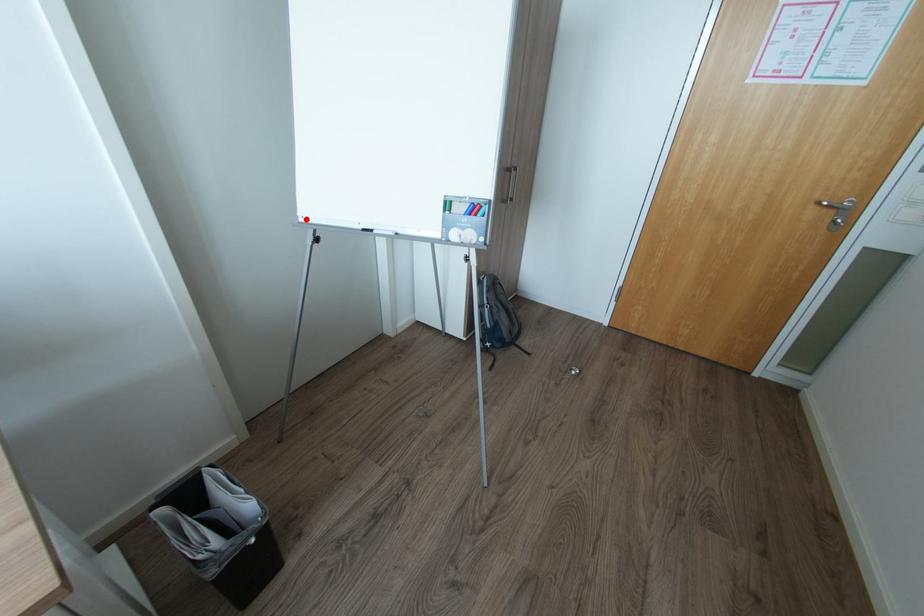
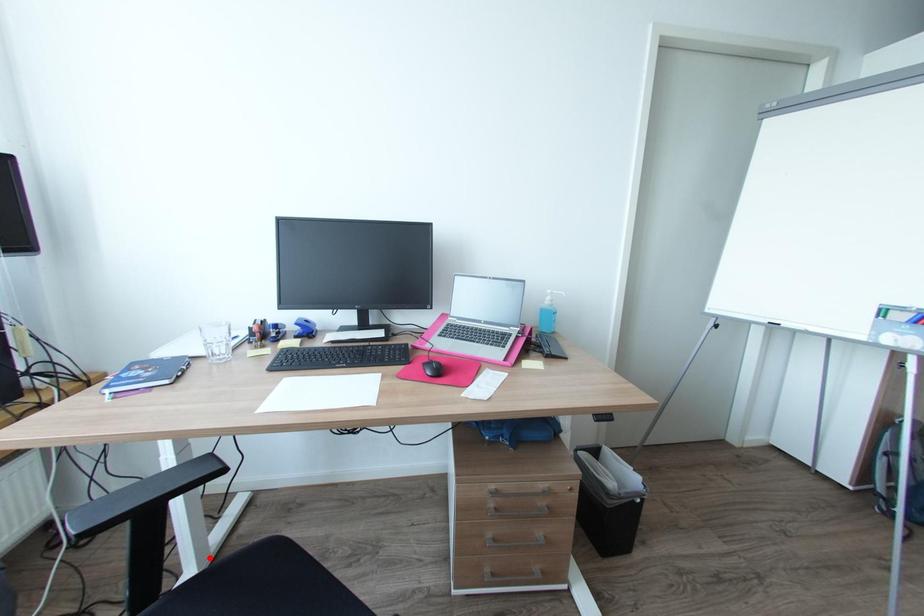
I am providing you with two images of the same scene from different viewpoints. A red point is marked on the first image and another point is marked on the second image. Does the point marked in image1 correspond to the same location as the one in image2?

No